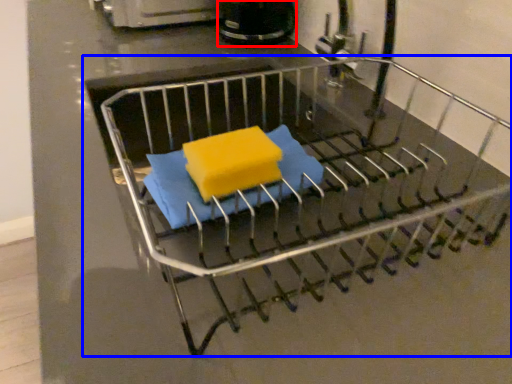
Question: Which point is further to the camera, appliance (highlighted by a red box) or furniture (highlighted by a blue box)?

Choices:
 (A) appliance
 (B) furniture

Answer: (A)